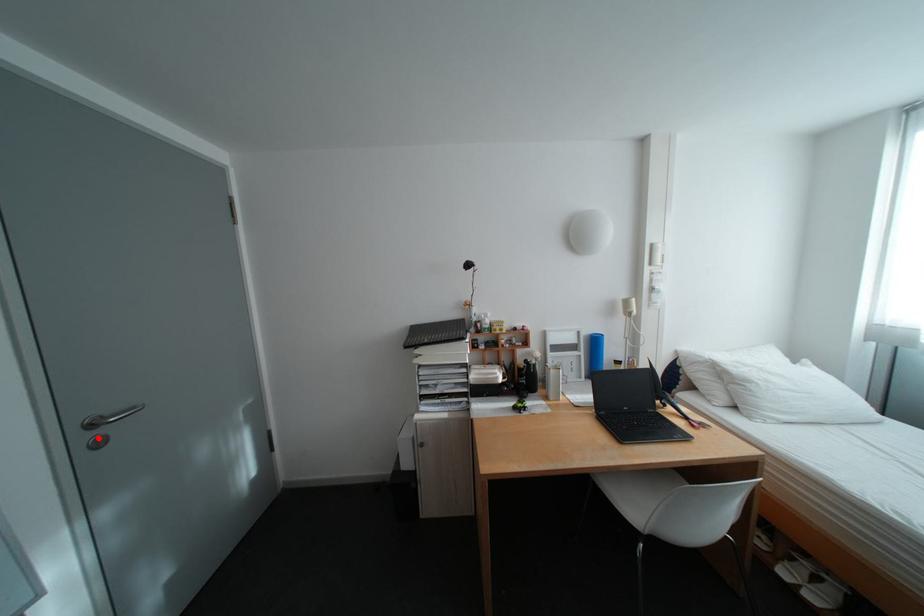
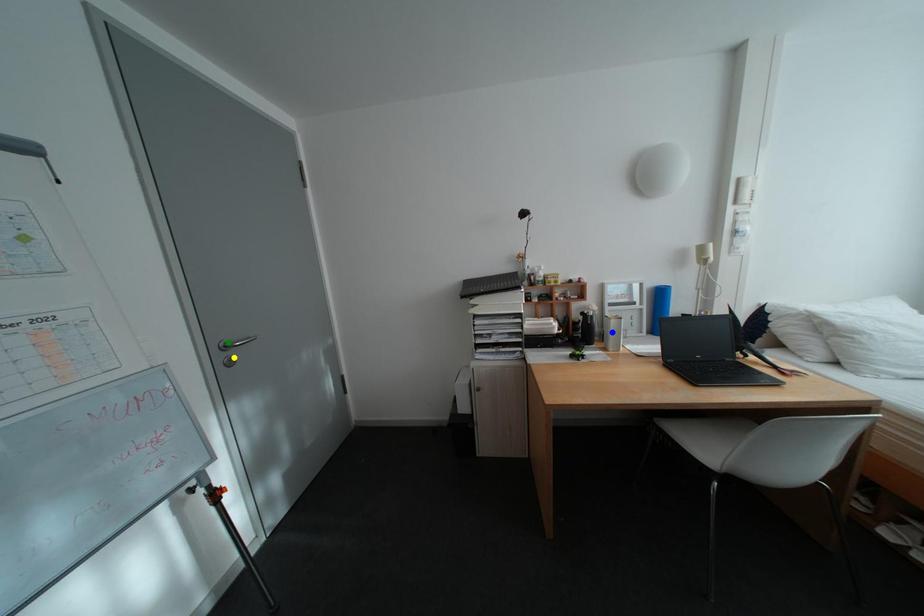
Question: I am providing you with two images of the same scene from different viewpoints. A red point is marked on the first image. You are given multiple points on the second image. In image 2, which mark is for the same physical point as the one in image 1?

Choices:
 (A) green point
 (B) yellow point
 (C) blue point

Answer: (B)